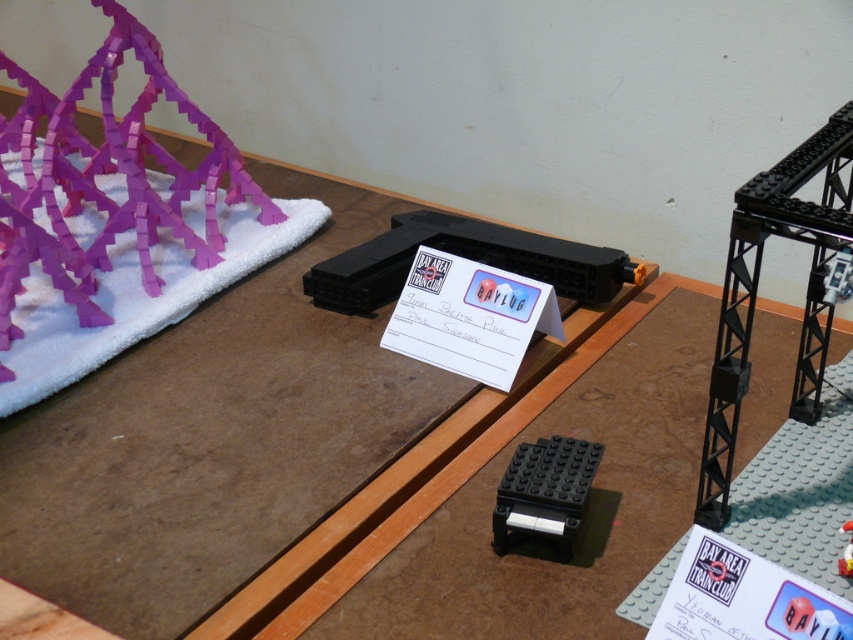
You are setting up a train display and need to place the purple plastic structure at upper left and the white glossy toy at center. According to the scene description, which object is located to the left of the other?

The purple plastic structure at upper left is positioned on the left side of the white glossy toy at center.

You are organizing a train display and need to place the purple plastic structure at upper left and the black matte platform at center. According to the setup, which object is positioned to the right side?

The black matte platform at center is positioned to the right of the purple plastic structure at upper left, so the black matte platform at center is on the right side.

You are setting up a train display and need to place both the purple plastic structure at upper left and the white glossy toy at center on a shelf. If the shelf has a width limit of 15 cm, can you fit both items side by side?

The purple plastic structure at upper left might be wider than the white glossy toy at center, so it is uncertain if both will fit within the 15 cm shelf width without overlapping. Check their combined width first.